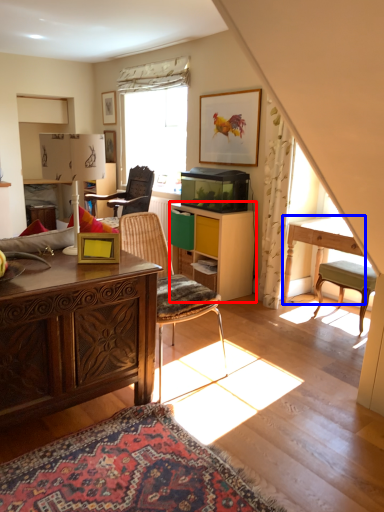
Question: Among these objects, which one is farthest to the camera, cabinetry (highlighted by a red box) or table (highlighted by a blue box)?

Choices:
 (A) cabinetry
 (B) table

Answer: (A)